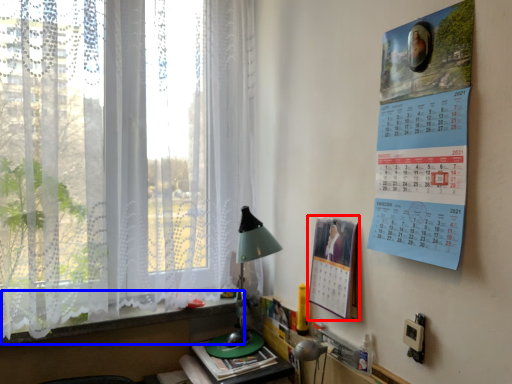
Question: Which point is further to the camera, poster page (highlighted by a red box) or window sill (highlighted by a blue box)?

Choices:
 (A) poster page
 (B) window sill

Answer: (B)